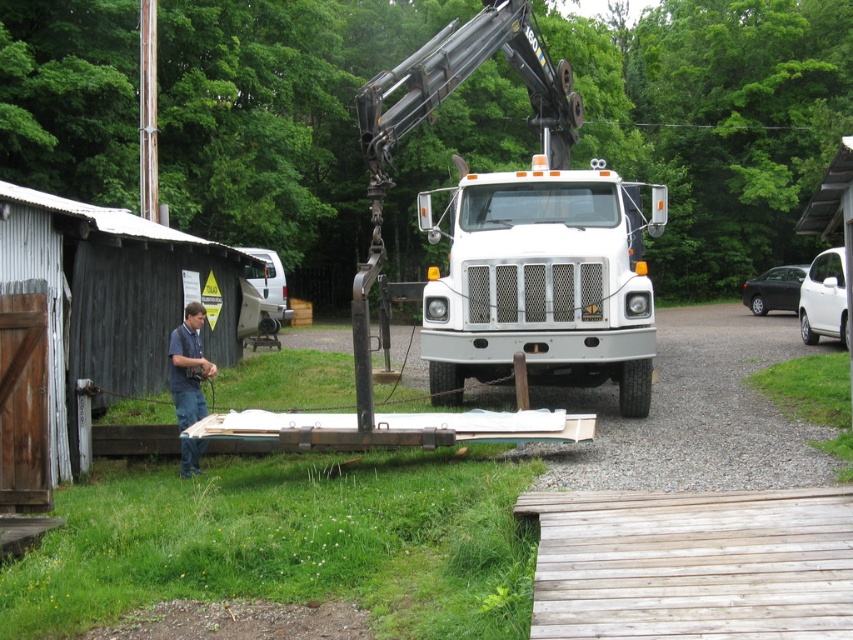
Is white matte truck at center wider than blue jeans at left?

Correct, the width of white matte truck at center exceeds that of blue jeans at left.

Can you confirm if white matte truck at center is taller than blue jeans at left?

Indeed, white matte truck at center has a greater height compared to blue jeans at left.

You are a GUI agent. You are given a task and a screenshot of the screen. Output one action in this format:
    pyautogui.click(x=<x>, y=<y>)
    Task: Click on the white matte truck at center
    This screenshot has height=640, width=853.
    Given the screenshot: What is the action you would take?
    pyautogui.click(x=543, y=282)

You are a GUI agent. You are given a task and a screenshot of the screen. Output one action in this format:
    pyautogui.click(x=<x>, y=<y>)
    Task: Click on the white matte truck at center
    Image resolution: width=853 pixels, height=640 pixels.
    Given the screenshot: What is the action you would take?
    pyautogui.click(x=543, y=282)